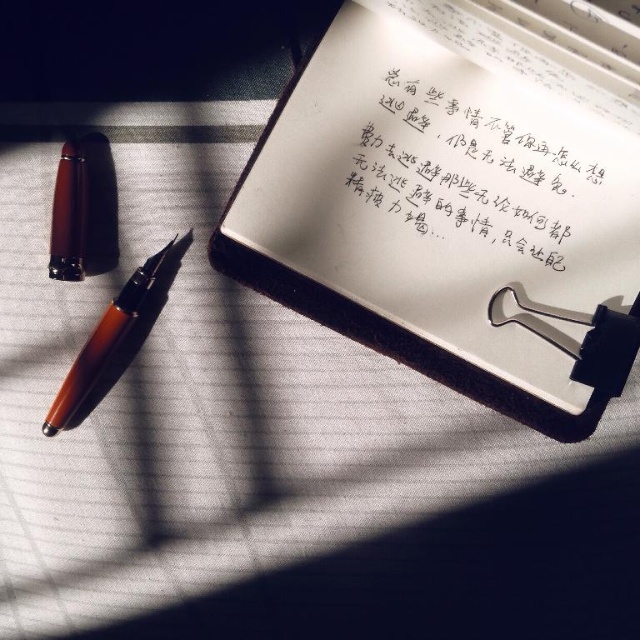
Question: Which of the following is the farthest from the observer?

Choices:
 (A) (554, 147)
 (B) (83, 390)
 (C) (536, 124)

Answer: (B)

Question: Can you confirm if black paper at upper center is positioned below translucent amber pen at center-left?

Choices:
 (A) no
 (B) yes

Answer: (A)

Question: Which point is closer to the camera?

Choices:
 (A) white paper notebook at upper center
 (B) brown polished wood pencil at left
 (C) translucent amber pen at center-left

Answer: (A)

Question: Which point is closer to the camera?

Choices:
 (A) (515, 324)
 (B) (134, 289)
 (C) (522, 125)
 (D) (83, 227)

Answer: (A)

Question: From the image, what is the correct spatial relationship of white paper notebook at upper center in relation to translucent amber pen at center-left?

Choices:
 (A) right
 (B) left

Answer: (A)

Question: Does white paper notebook at upper center have a larger size compared to brown polished wood pencil at left?

Choices:
 (A) yes
 (B) no

Answer: (A)